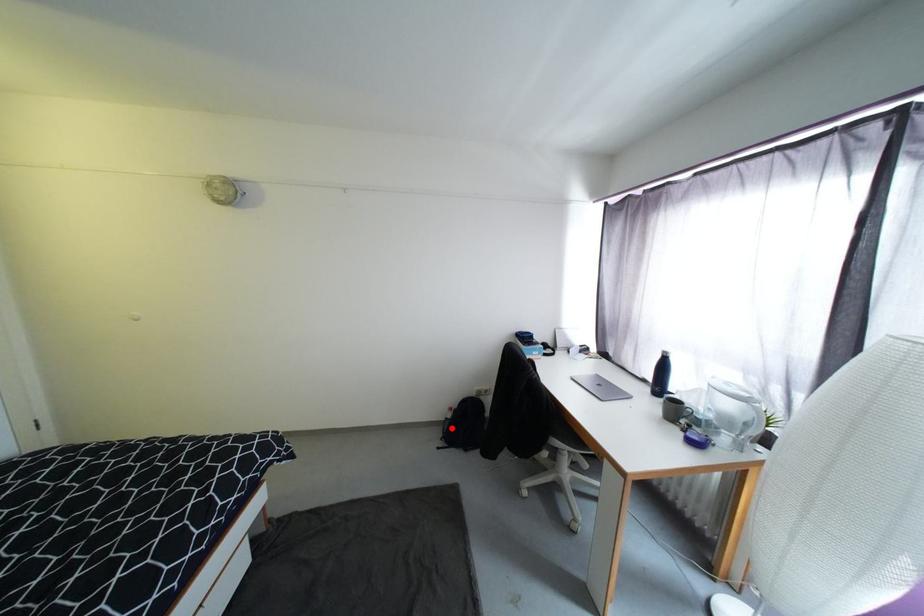
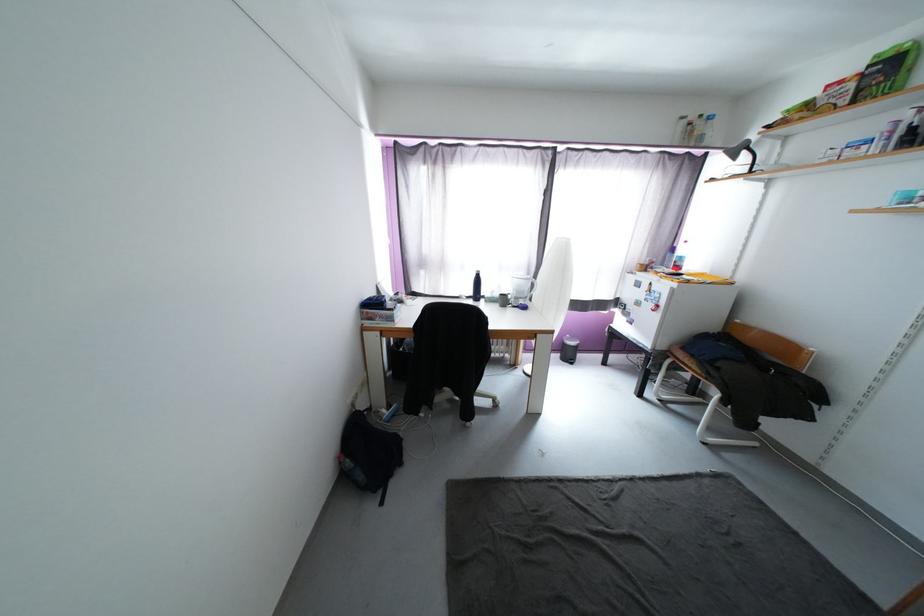
Question: A red point is marked in image1. In image2, is the corresponding 3D point closer to the camera or farther? Reply with the corresponding letter.

Choices:
 (A) The corresponding 3D point is closer.
 (B) The corresponding 3D point is farther.

Answer: (A)